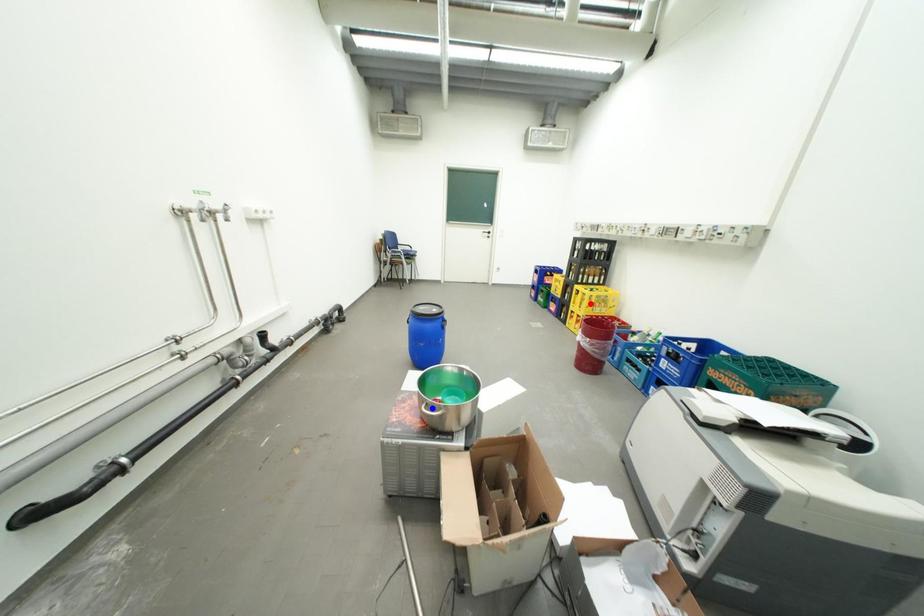
Question: Which of the two points in the image is closer to the camera?

Choices:
 (A) Blue point is closer.
 (B) Red point is closer.

Answer: (A)